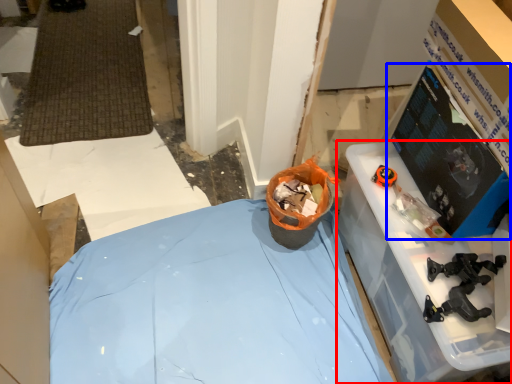
Question: Which object appears closest to the camera in this image, furniture (highlighted by a red box) or computer monitor (highlighted by a blue box)?

Choices:
 (A) furniture
 (B) computer monitor

Answer: (B)